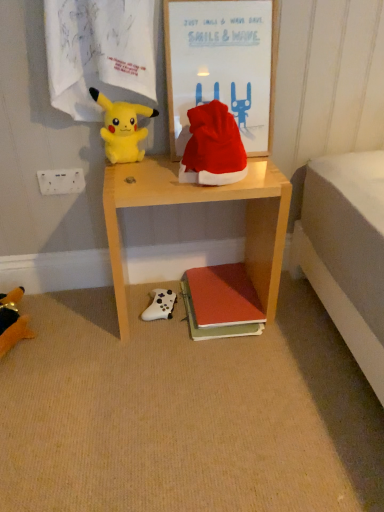
In order to click on vacant space positioned to the left of white matte game controller at lower center, the first toy positioned from the right in this screenshot , I will do `click(112, 306)`.